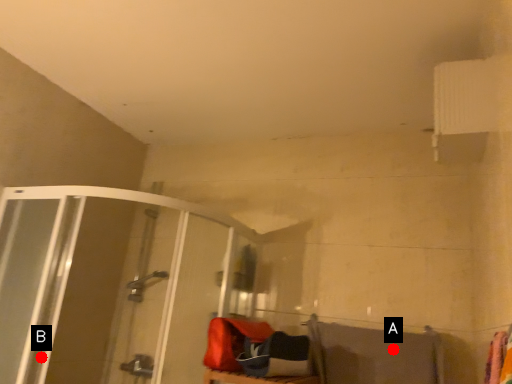
Question: Two points are circled on the image, labeled by A and B beside each circle. Among these points, which one is nearest to the camera?

Choices:
 (A) A is closer
 (B) B is closer

Answer: (A)